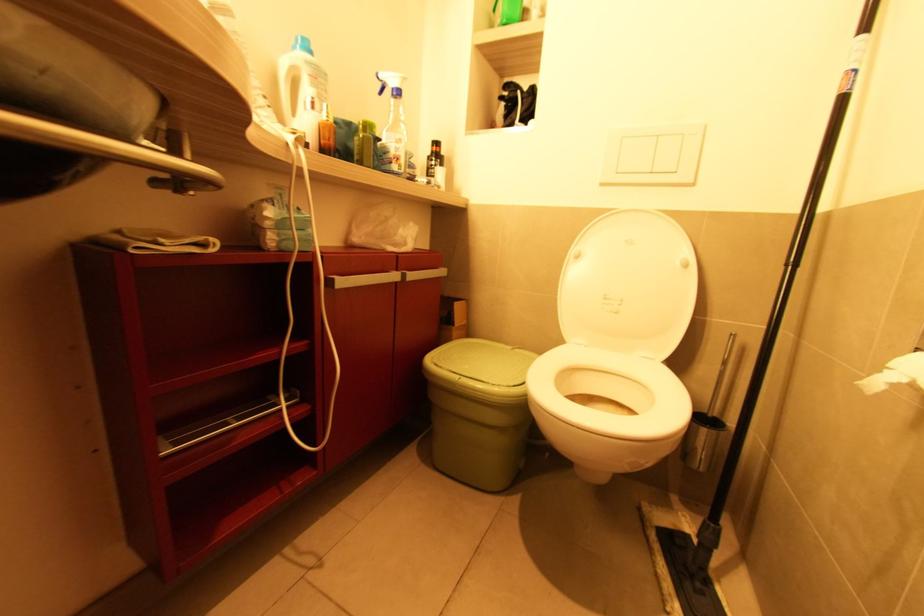
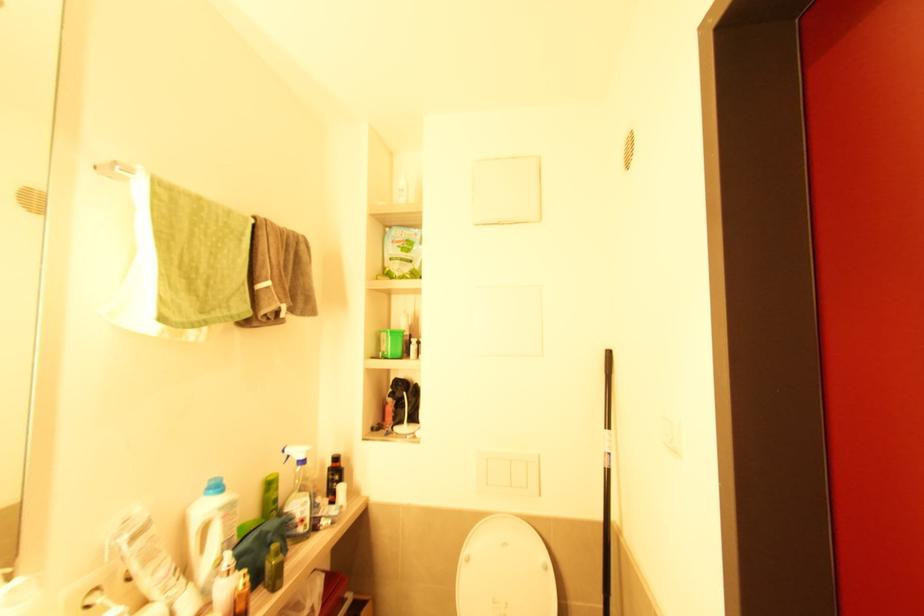
The point at (393, 163) is marked in the first image. Where is the corresponding point in the second image?

(298, 527)